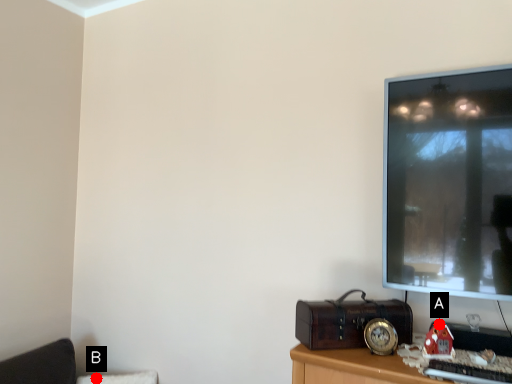
Question: Two points are circled on the image, labeled by A and B beside each circle. Which point is closer to the camera?

Choices:
 (A) A is closer
 (B) B is closer

Answer: (A)